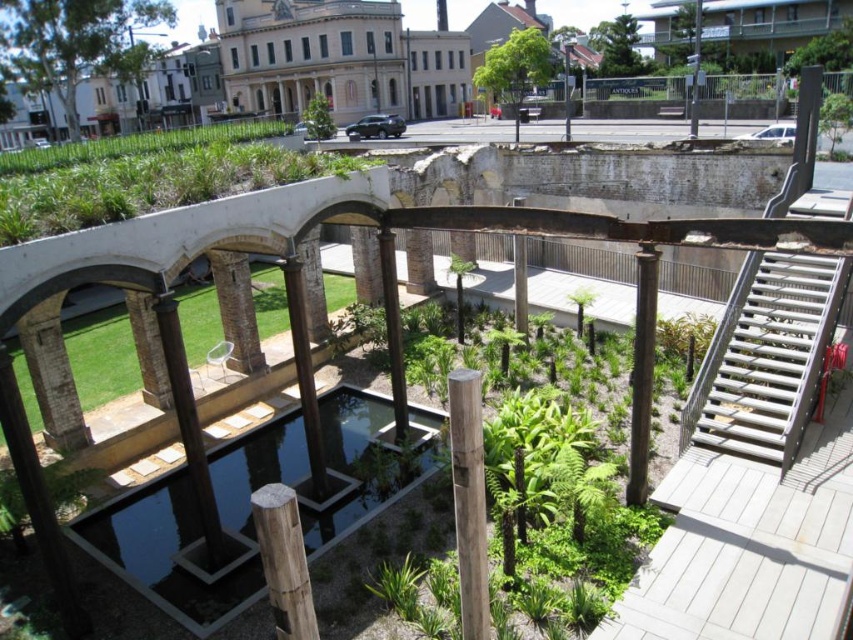
Question: Is green grass at upper center to the left of green leafy plant at center from the viewer's perspective?

Choices:
 (A) yes
 (B) no

Answer: (B)

Question: Can you confirm if metallic silver stairs at right is smaller than brown wood post at center?

Choices:
 (A) yes
 (B) no

Answer: (A)

Question: Does wooden post at center appear over green leafy plant at center?

Choices:
 (A) no
 (B) yes

Answer: (A)

Question: Which point is farther to the camera?

Choices:
 (A) metallic silver stairs at right
 (B) brown wood post at center
 (C) green grass at upper center

Answer: (A)

Question: Which point is farther from the camera taking this photo?

Choices:
 (A) (471, 460)
 (B) (809, 196)
 (C) (311, 99)

Answer: (C)

Question: Which of the following is the farthest from the observer?

Choices:
 (A) wooden post at center
 (B) brown wood post at center

Answer: (B)